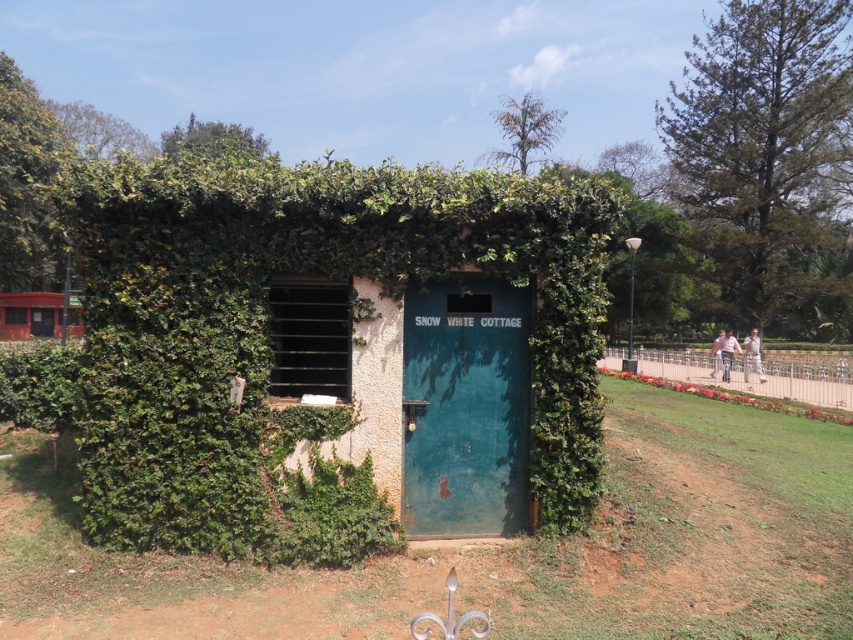
Is teal matte door at center below orange painted wooden signboard at left?

Yes, teal matte door at center is below orange painted wooden signboard at left.

From the picture: Who is more distant from viewer, (520, 314) or (3, 301)?

The point (3, 301) is more distant.

Which is in front, point (404, 456) or point (22, 333)?

Point (404, 456) is in front.

The width and height of the screenshot is (853, 640). I want to click on teal matte door at center, so click(x=465, y=406).

Which is more to the left, green textured door at center or teal matte door at center?

teal matte door at center

Does green textured door at center appear on the right side of teal matte door at center?

Yes, green textured door at center is to the right of teal matte door at center.

Does point (172, 292) come farther from viewer compared to point (444, 449)?

No, (172, 292) is closer to viewer.

This screenshot has width=853, height=640. What are the coordinates of `green textured door at center` in the screenshot? It's located at (271, 321).

Looking at this image, who is taller, green textured door at center or orange painted wooden signboard at left?

green textured door at center

Who is more forward, (x=575, y=253) or (x=67, y=312)?

Point (x=575, y=253) is in front.

Is point (132, 269) positioned after point (32, 333)?

No, it is not.

At what (x,y) coordinates should I click in order to perform the action: click on green textured door at center. Please return your answer as a coordinate pair (x, y). This screenshot has width=853, height=640. Looking at the image, I should click on (271, 321).